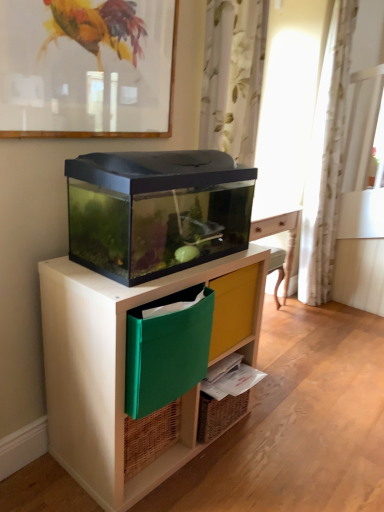
Where is `free space in front of white floral fabric curtain at right, acting as the 1th curtain starting from the right`? This screenshot has height=512, width=384. free space in front of white floral fabric curtain at right, acting as the 1th curtain starting from the right is located at coordinates 327,313.